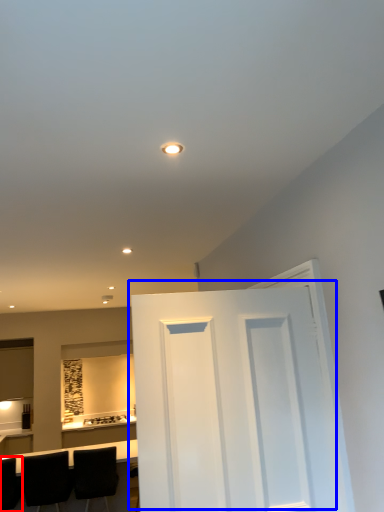
Question: Among these objects, which one is farthest to the camera, chair (highlighted by a red box) or door (highlighted by a blue box)?

Choices:
 (A) chair
 (B) door

Answer: (A)